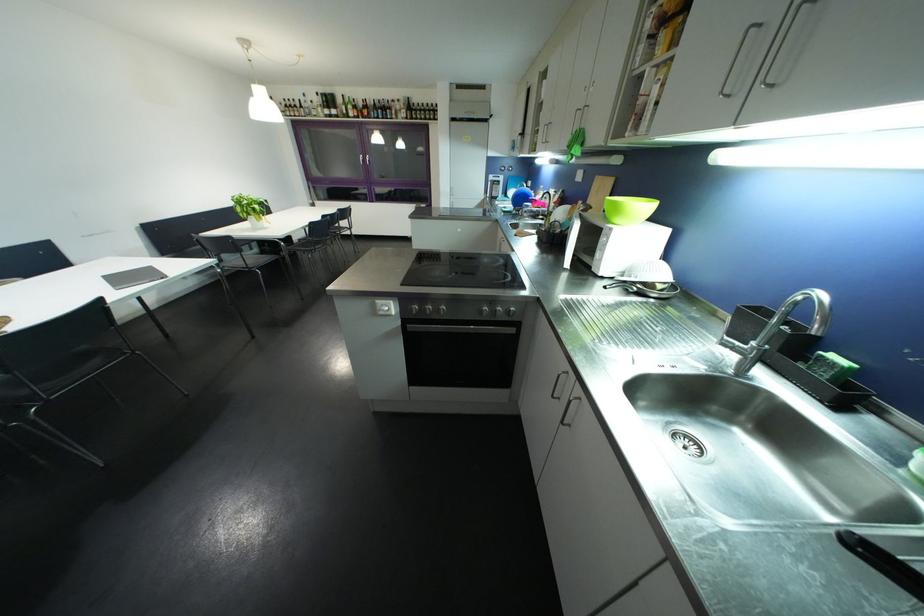
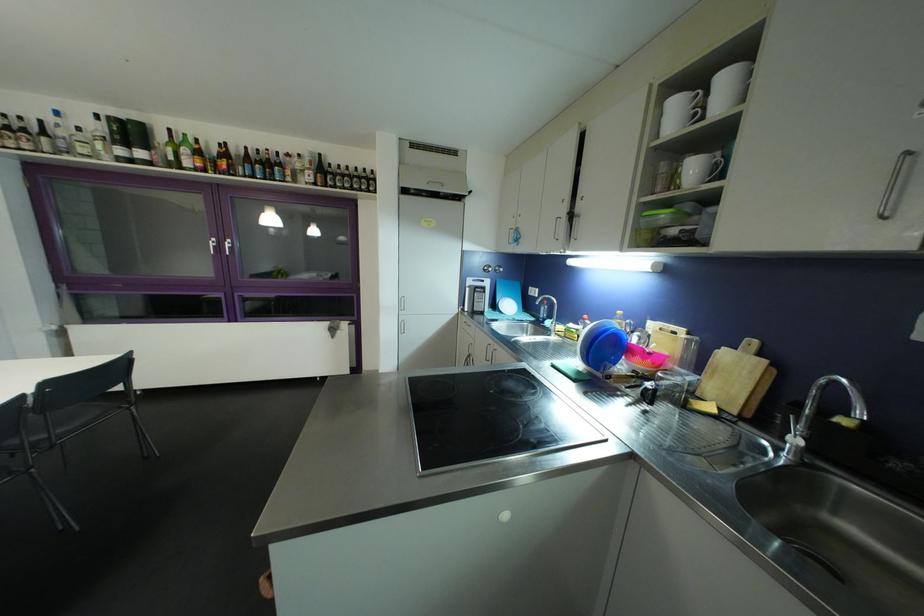
Locate, in the second image, the point that corresponds to point 322,107 in the first image.

(94, 137)